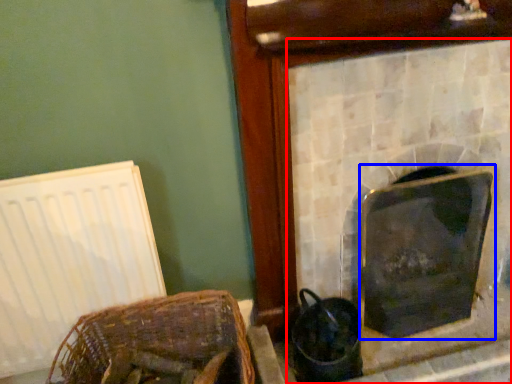
Question: Which object is further to the camera taking this photo, fireplace (highlighted by a red box) or fireplace (highlighted by a blue box)?

Choices:
 (A) fireplace
 (B) fireplace

Answer: (B)